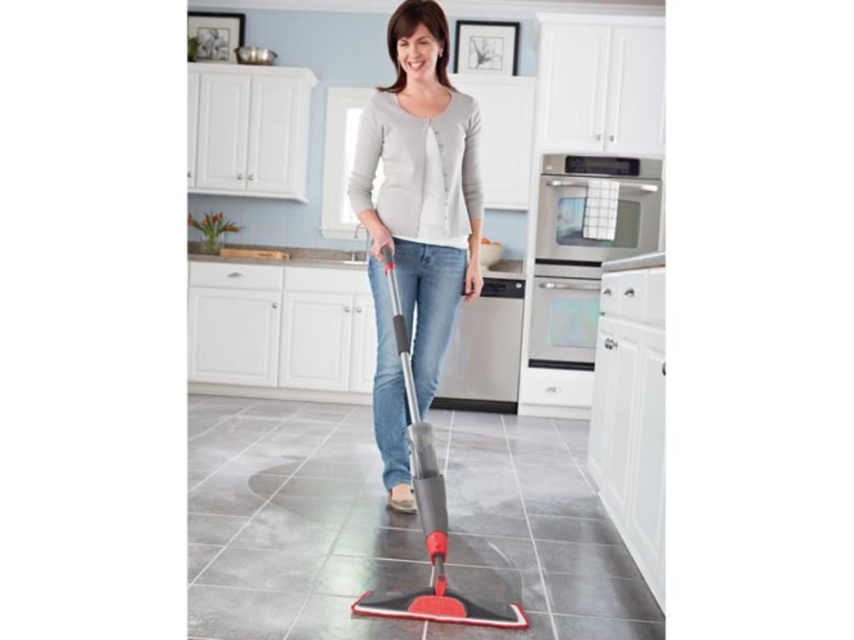
You are standing in the kitchen and want to check if you can reach a point that is 2.47 meters away from you. The point is labeled as point (471, 104). Can you confirm if this point is within your reach?

The distance of point (471, 104) from viewer is 2.47 meters, so if your reach extends to at least 2.47 meters, you can reach it. Otherwise, you might need to move closer.

You are a home assistant robot in a modern kitchen. You need to reach the red rubber mop at center to help clean the floor. However, there is a gray matte sweater at center in your path. Based on their positions, can you determine which object is on the right side of the other?

The gray matte sweater at center is positioned on the right side of the red rubber mop at center, so the gray matte sweater at center is on the right side of the red rubber mop at center.

You are helping someone organize their kitchen. They want to place the gray matte sweater at center and the red rubber mop at center on the same counter. The counter has limited space. Based on their sizes, which item should be placed first to ensure both fit?

The red rubber mop at center should be placed first because the gray matte sweater at center is wider, so placing the smaller item first allows more space for the larger one.